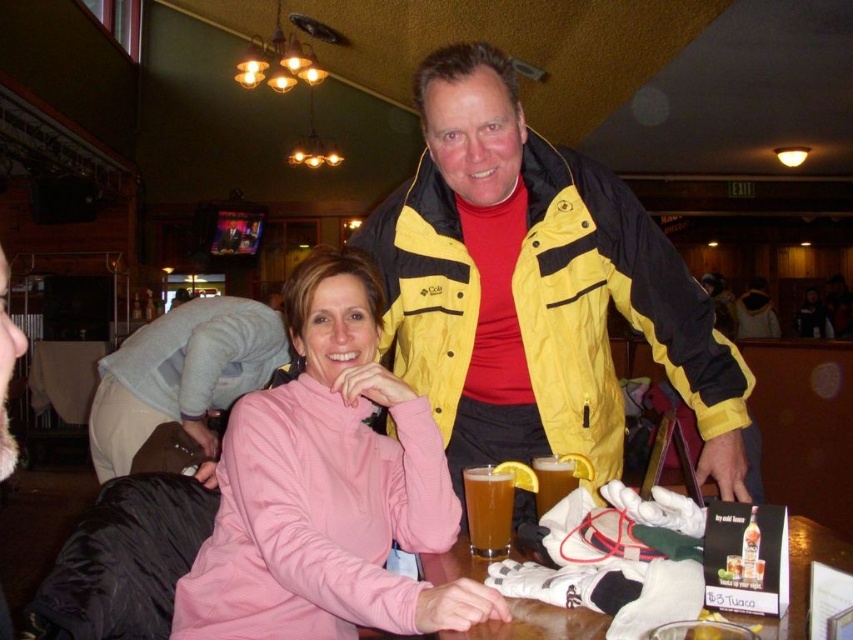
Who is positioned more to the left, pink fleece at center or translucent glass at center?

Positioned to the left is pink fleece at center.

Is pink fleece at center bigger than translucent glass at center?

Indeed, pink fleece at center has a larger size compared to translucent glass at center.

Locate an element on the screen. This screenshot has width=853, height=640. pink fleece at center is located at coordinates (328, 490).

Is gray fleece jacket at lower left in front of translucent glass at center?

No, gray fleece jacket at lower left is further to the viewer.

Locate an element on the screen. gray fleece jacket at lower left is located at coordinates (181, 376).

Can you confirm if translucent glass at center is wider than translucent glass mug at center?

Indeed, translucent glass at center has a greater width compared to translucent glass mug at center.

Where is `translucent glass at center`? translucent glass at center is located at coordinates (488, 509).